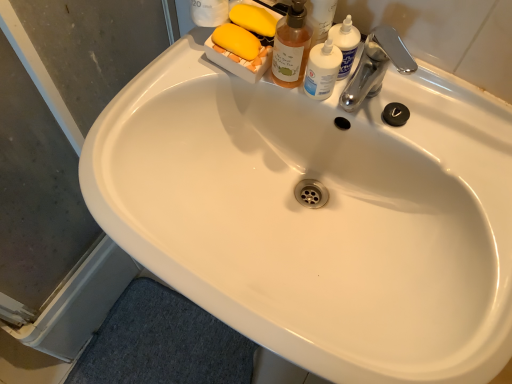
Question: Considering the relative sizes of silver metallic faucet at upper right and translucent amber bottle at upper right in the image provided, is silver metallic faucet at upper right smaller than translucent amber bottle at upper right?

Choices:
 (A) yes
 (B) no

Answer: (B)

Question: Is silver metallic faucet at upper right positioned beyond the bounds of translucent amber bottle at upper right?

Choices:
 (A) no
 (B) yes

Answer: (B)

Question: From the image's perspective, does silver metallic faucet at upper right appear higher than translucent amber bottle at upper right?

Choices:
 (A) no
 (B) yes

Answer: (A)

Question: From the image's perspective, does silver metallic faucet at upper right appear lower than translucent amber bottle at upper right?

Choices:
 (A) no
 (B) yes

Answer: (B)

Question: Is silver metallic faucet at upper right positioned far away from translucent amber bottle at upper right?

Choices:
 (A) no
 (B) yes

Answer: (A)

Question: Is point (1, 235) positioned closer to the camera than point (362, 87)?

Choices:
 (A) closer
 (B) farther

Answer: (B)

Question: In terms of width, does transparent glass screen door at lower left look wider or thinner when compared to silver metallic faucet at upper right?

Choices:
 (A) thin
 (B) wide

Answer: (A)

Question: From the image's perspective, relative to silver metallic faucet at upper right, is transparent glass screen door at lower left above or below?

Choices:
 (A) above
 (B) below

Answer: (B)

Question: Considering the positions of transparent glass screen door at lower left and silver metallic faucet at upper right in the image, is transparent glass screen door at lower left bigger or smaller than silver metallic faucet at upper right?

Choices:
 (A) small
 (B) big

Answer: (B)

Question: Choose the correct answer: Is silver metallic faucet at upper right inside translucent plastic bottle at upper right or outside it?

Choices:
 (A) outside
 (B) inside

Answer: (A)

Question: Considering the positions of silver metallic faucet at upper right and translucent plastic bottle at upper right in the image, is silver metallic faucet at upper right wider or thinner than translucent plastic bottle at upper right?

Choices:
 (A) wide
 (B) thin

Answer: (A)

Question: Considering their positions, is silver metallic faucet at upper right located in front of or behind translucent plastic bottle at upper right?

Choices:
 (A) behind
 (B) front

Answer: (B)

Question: From the image's perspective, relative to translucent plastic bottle at upper right, is silver metallic faucet at upper right above or below?

Choices:
 (A) above
 (B) below

Answer: (B)

Question: From a real-world perspective, is translucent amber bottle at upper right physically located above or below transparent glass screen door at lower left?

Choices:
 (A) above
 (B) below

Answer: (A)

Question: Considering the relative positions of translucent amber bottle at upper right and transparent glass screen door at lower left in the image provided, is translucent amber bottle at upper right to the left or to the right of transparent glass screen door at lower left?

Choices:
 (A) left
 (B) right

Answer: (B)